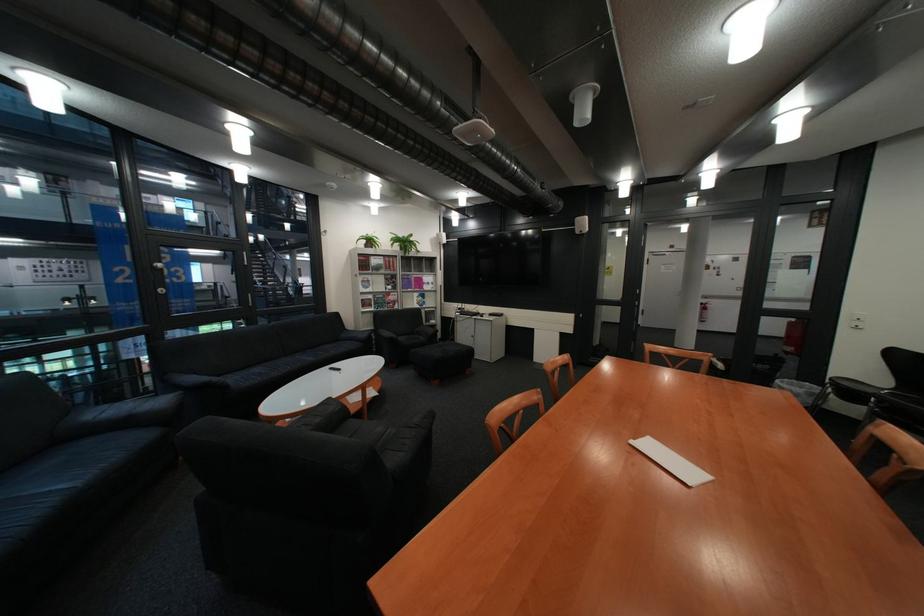
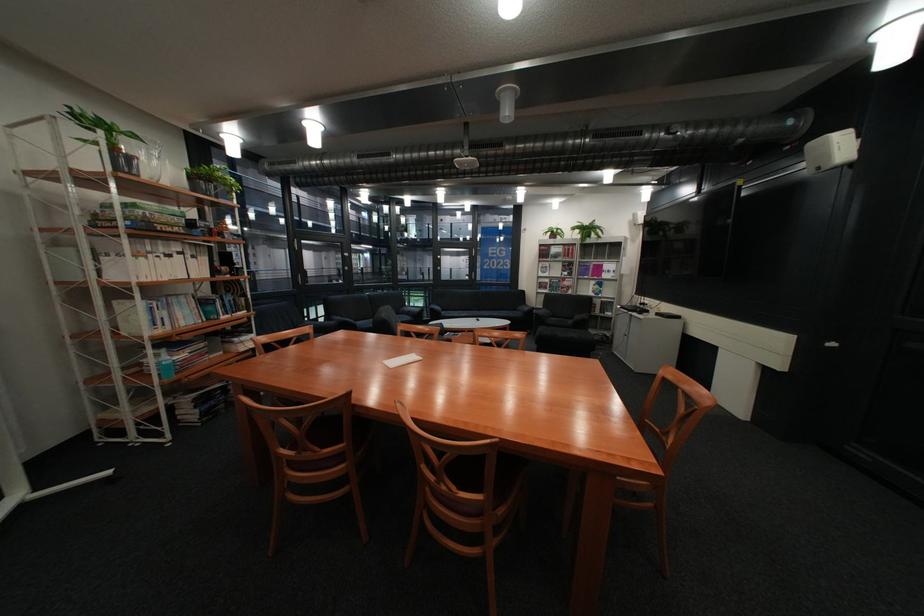
Find the pixel in the second image that matches the point at 409,236 in the first image.

(594, 225)